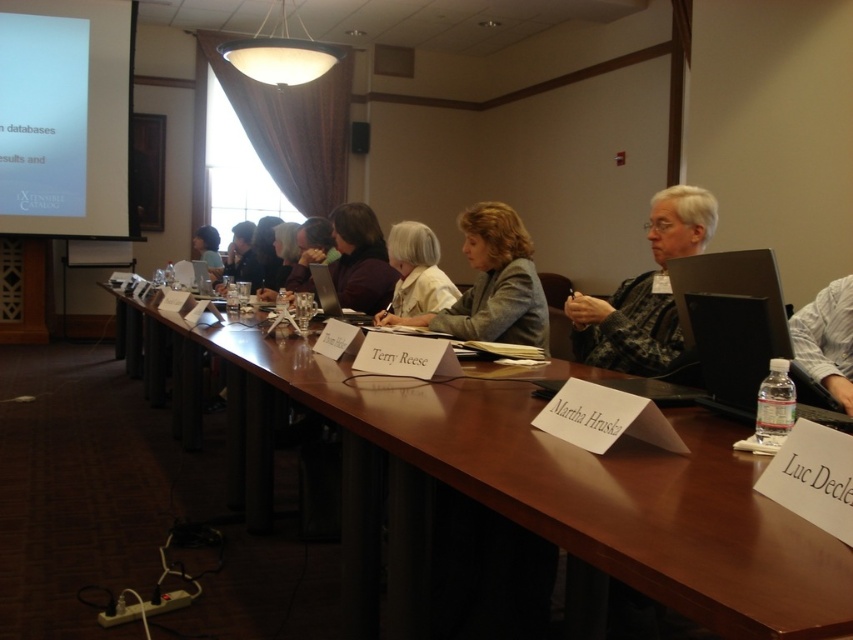
Who is lower down, plaid fabric shirt at center or light gray fabric jacket at center?

plaid fabric shirt at center

Is plaid fabric shirt at center thinner than light gray fabric jacket at center?

Correct, plaid fabric shirt at center's width is less than light gray fabric jacket at center's.

Which is behind, point (613, 300) or point (424, 321)?

The point (424, 321) is more distant.

Where is `plaid fabric shirt at center`? plaid fabric shirt at center is located at coordinates (625, 328).

Does black glossy laptop at center appear under matte black laptop at upper center?

Correct, black glossy laptop at center is located below matte black laptop at upper center.

Can you confirm if black glossy laptop at center is shorter than matte black laptop at upper center?

Indeed, black glossy laptop at center has a lesser height compared to matte black laptop at upper center.

The width and height of the screenshot is (853, 640). Identify the location of black glossy laptop at center. (325, 289).

I want to click on black glossy laptop at center, so click(x=325, y=289).

Can you confirm if brown wood table at center is shorter than white matte projection screen at upper left?

Indeed, brown wood table at center has a lesser height compared to white matte projection screen at upper left.

Is point (793, 557) less distant than point (42, 61)?

Yes.

The image size is (853, 640). I want to click on brown wood table at center, so click(509, 486).